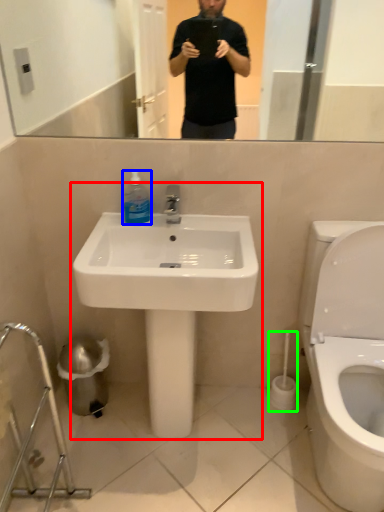
Question: Which object is the closest to the sink (highlighted by a red box)? Choose among these: cleaning product (highlighted by a blue box) or brush (highlighted by a green box).

Choices:
 (A) cleaning product
 (B) brush

Answer: (A)